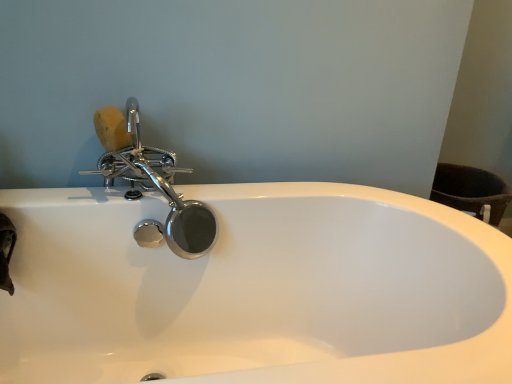
Question: From the image's perspective, would you say polished chrome faucet at upper left is shown under natural sponge at upper left?

Choices:
 (A) yes
 (B) no

Answer: (A)

Question: From a real-world perspective, is polished chrome faucet at upper left located beneath natural sponge at upper left?

Choices:
 (A) no
 (B) yes

Answer: (B)

Question: Is polished chrome faucet at upper left positioned with its back to natural sponge at upper left?

Choices:
 (A) yes
 (B) no

Answer: (A)

Question: Can you see polished chrome faucet at upper left touching natural sponge at upper left?

Choices:
 (A) no
 (B) yes

Answer: (A)

Question: Is polished chrome faucet at upper left taller than natural sponge at upper left?

Choices:
 (A) yes
 (B) no

Answer: (A)

Question: Is polished chrome faucet at upper left surrounding natural sponge at upper left?

Choices:
 (A) no
 (B) yes

Answer: (B)

Question: From the image's perspective, is natural sponge at upper left located above polished chrome faucet at upper left?

Choices:
 (A) yes
 (B) no

Answer: (A)

Question: Can you confirm if natural sponge at upper left is positioned to the left of polished chrome faucet at upper left?

Choices:
 (A) no
 (B) yes

Answer: (B)

Question: Can you confirm if natural sponge at upper left is smaller than polished chrome faucet at upper left?

Choices:
 (A) yes
 (B) no

Answer: (A)

Question: From the image's perspective, does natural sponge at upper left appear lower than polished chrome faucet at upper left?

Choices:
 (A) no
 (B) yes

Answer: (A)

Question: Is natural sponge at upper left positioned in front of polished chrome faucet at upper left?

Choices:
 (A) no
 (B) yes

Answer: (A)

Question: Considering the relative sizes of natural sponge at upper left and polished chrome faucet at upper left in the image provided, is natural sponge at upper left taller than polished chrome faucet at upper left?

Choices:
 (A) no
 (B) yes

Answer: (A)

Question: Is polished chrome faucet at upper left bigger or smaller than natural sponge at upper left?

Choices:
 (A) big
 (B) small

Answer: (A)